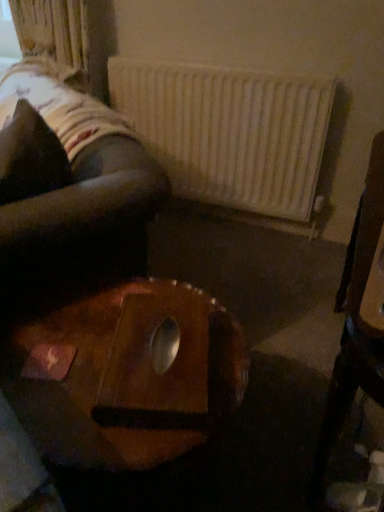
Question: From a real-world perspective, is velvety black pillow at upper left physically below white matte radiator at upper center?

Choices:
 (A) no
 (B) yes

Answer: (A)

Question: From the image's perspective, does velvety black pillow at upper left appear higher than white matte radiator at upper center?

Choices:
 (A) no
 (B) yes

Answer: (A)

Question: Is velvety black pillow at upper left oriented towards white matte radiator at upper center?

Choices:
 (A) yes
 (B) no

Answer: (B)

Question: Considering the relative sizes of velvety black pillow at upper left and white matte radiator at upper center in the image provided, is velvety black pillow at upper left shorter than white matte radiator at upper center?

Choices:
 (A) yes
 (B) no

Answer: (A)

Question: Does velvety black pillow at upper left have a larger size compared to white matte radiator at upper center?

Choices:
 (A) no
 (B) yes

Answer: (A)

Question: Is point (231, 136) positioned closer to the camera than point (64, 181)?

Choices:
 (A) closer
 (B) farther

Answer: (B)

Question: In terms of height, does white matte radiator at upper center look taller or shorter compared to velvety black pillow at upper left?

Choices:
 (A) short
 (B) tall

Answer: (B)

Question: From a real-world perspective, is white matte radiator at upper center positioned above or below velvety black pillow at upper left?

Choices:
 (A) below
 (B) above

Answer: (A)

Question: Relative to velvety black pillow at upper left, is white matte radiator at upper center in front or behind?

Choices:
 (A) behind
 (B) front

Answer: (A)

Question: Does point (94, 406) appear closer or farther from the camera than point (319, 106)?

Choices:
 (A) farther
 (B) closer

Answer: (B)

Question: In terms of height, does wooden table at center look taller or shorter compared to white matte radiator at upper center?

Choices:
 (A) tall
 (B) short

Answer: (B)

Question: From the image's perspective, is wooden table at center above or below white matte radiator at upper center?

Choices:
 (A) above
 (B) below

Answer: (B)

Question: Considering the positions of wooden table at center and white matte radiator at upper center in the image, is wooden table at center wider or thinner than white matte radiator at upper center?

Choices:
 (A) thin
 (B) wide

Answer: (B)

Question: From a real-world perspective, is velvety black pillow at upper left positioned above or below wooden chair at right?

Choices:
 (A) below
 (B) above

Answer: (B)

Question: Is velvety black pillow at upper left inside or outside of wooden chair at right?

Choices:
 (A) outside
 (B) inside

Answer: (A)